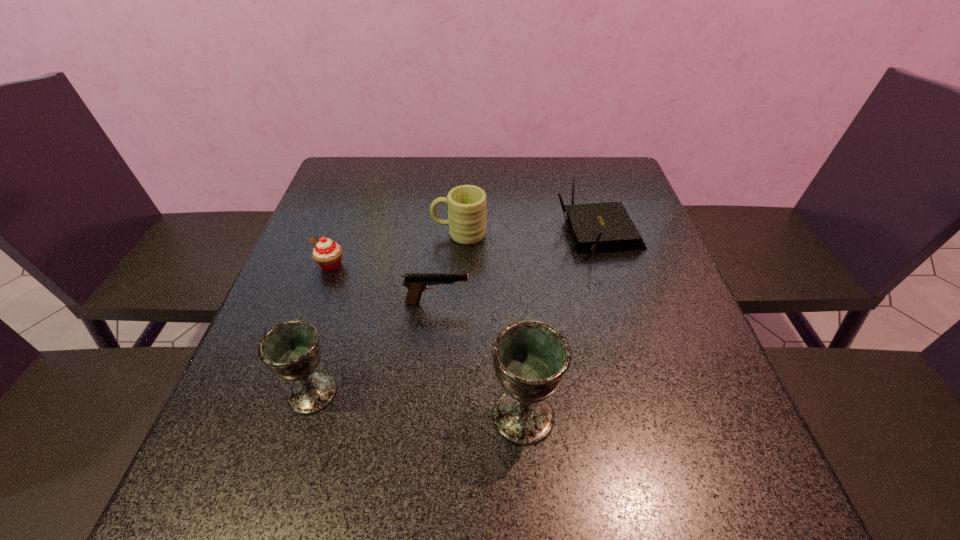
You are a GUI agent. You are given a task and a screenshot of the screen. Output one action in this format:
    pyautogui.click(x=<x>, y=<y>)
    Task: Click on the free space between the tallest object and the mug
    The width and height of the screenshot is (960, 540).
    Given the screenshot: What is the action you would take?
    pyautogui.click(x=492, y=325)

Locate an element on the screen. Image resolution: width=960 pixels, height=540 pixels. free space between the right chalice and the second tallest object is located at coordinates (418, 404).

What are the coordinates of `vacant area that lies between the cupcake and the left chalice` in the screenshot? It's located at (322, 329).

You are a GUI agent. You are given a task and a screenshot of the screen. Output one action in this format:
    pyautogui.click(x=<x>, y=<y>)
    Task: Click on the vacant area between the right chalice and the cupcake
    This screenshot has height=540, width=960.
    Given the screenshot: What is the action you would take?
    pyautogui.click(x=427, y=340)

Where is `object that ranks as the fifth closest to the second object from right to left`? This screenshot has height=540, width=960. object that ranks as the fifth closest to the second object from right to left is located at coordinates click(x=327, y=254).

The image size is (960, 540). Identify the location of object identified as the second closest to the cupcake. (467, 212).

Identify the location of free spot that satisfies the following two spatial constraints: 1. on the side of the tallest object with the handle; 2. on the left side of the mug. (449, 416).

At what (x,y) coordinates should I click in order to perform the action: click on free space that satisfies the following two spatial constraints: 1. on the front side of the router; 2. on the side of the mug with the handle. Please return your answer as a coordinate pair (x, y). The width and height of the screenshot is (960, 540). Looking at the image, I should click on (598, 233).

Locate an element on the screen. This screenshot has width=960, height=540. free point that satisfies the following two spatial constraints: 1. on the front side of the router; 2. at the muzzle of the fourth farthest object is located at coordinates (619, 302).

This screenshot has width=960, height=540. I want to click on free space that satisfies the following two spatial constraints: 1. on the back side of the second object from right to left; 2. on the side of the fourth shortest object with the handle, so click(x=510, y=233).